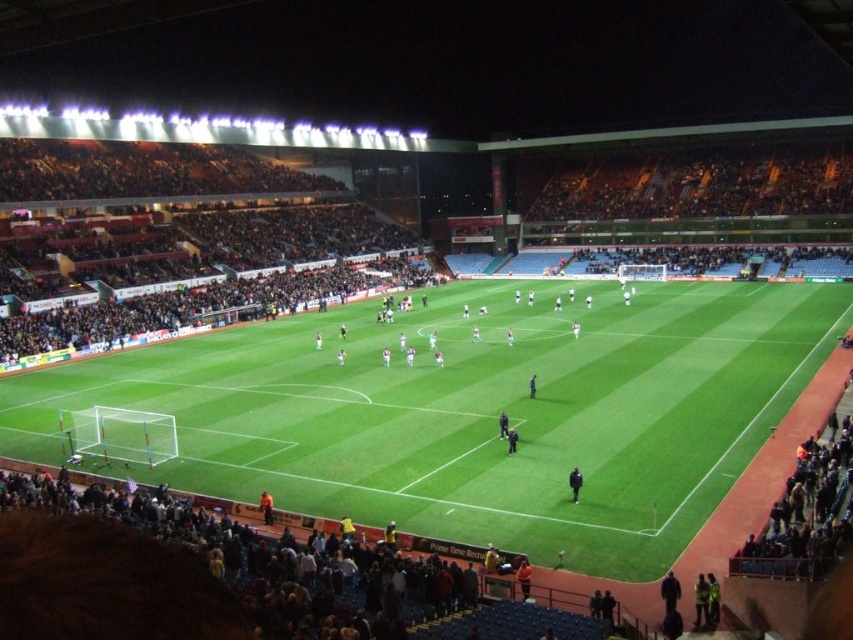
Can you confirm if black fabric person at center is shorter than dark blue uniform at center?

In fact, black fabric person at center may be taller than dark blue uniform at center.

Which is behind, point (509, 436) or point (531, 378)?

Positioned behind is point (531, 378).

Locate an element on the screen. This screenshot has height=640, width=853. black fabric person at center is located at coordinates (511, 440).

Which is more to the right, green grass football field at center or dark blue uniform at center?

green grass football field at center

Which is in front, point (303, 413) or point (535, 384)?

Point (303, 413)

The width and height of the screenshot is (853, 640). What are the coordinates of `green grass football field at center` in the screenshot? It's located at (474, 412).

Which is in front, point (305, 468) or point (569, 486)?

Point (569, 486)

Who is more distant from viewer, (413, 461) or (572, 493)?

Positioned behind is point (413, 461).

Between point (328, 404) and point (576, 486), which one is positioned in front?

Point (576, 486)

The image size is (853, 640). Find the location of `green grass football field at center`. green grass football field at center is located at coordinates (474, 412).